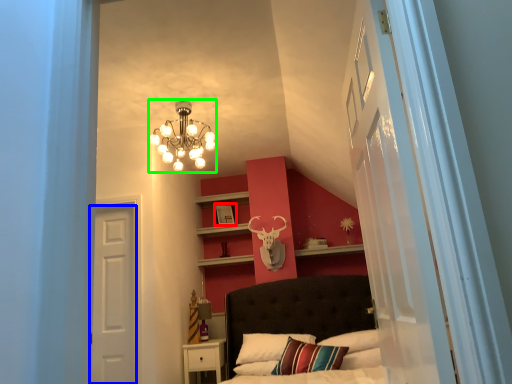
Question: Which object is the closest to the picture frame (highlighted by a red box)? Choose among these: door (highlighted by a blue box) or lamp (highlighted by a green box).

Choices:
 (A) door
 (B) lamp

Answer: (B)